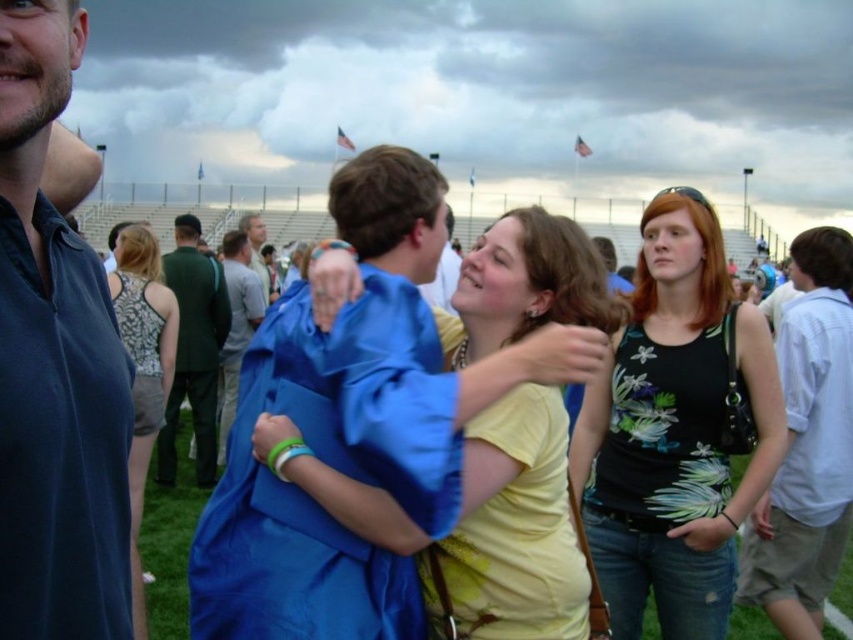
Who is lower down, floral print tank top at center or light brown hair at center?

floral print tank top at center is lower down.

Can you confirm if floral print tank top at center is taller than light brown hair at center?

In fact, floral print tank top at center may be shorter than light brown hair at center.

At what (x,y) coordinates should I click in order to perform the action: click on floral print tank top at center. Please return your answer as a coordinate pair (x, y). Image resolution: width=853 pixels, height=640 pixels. Looking at the image, I should click on (674, 432).

Identify the location of floral print tank top at center. This screenshot has height=640, width=853. (674, 432).

Is dark blue polo shirt at left shorter than light brown hair at center?

No.

Is the position of dark blue polo shirt at left more distant than that of light brown hair at center?

No.

Locate an element on the screen. This screenshot has height=640, width=853. dark blue polo shirt at left is located at coordinates (54, 365).

The width and height of the screenshot is (853, 640). I want to click on dark blue polo shirt at left, so click(54, 365).

Does white cotton shirt at right appear over printed fabric tank top at center?

No.

Does point (775, 561) lie behind point (131, 333)?

No, it is not.

Image resolution: width=853 pixels, height=640 pixels. What are the coordinates of `white cotton shirt at right` in the screenshot? It's located at (807, 444).